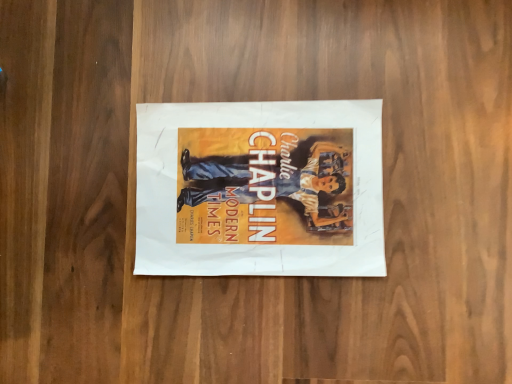
Describe the element at coordinates (260, 189) in the screenshot. I see `matte paper poster at center` at that location.

Where is `matte paper poster at center`? The width and height of the screenshot is (512, 384). matte paper poster at center is located at coordinates (260, 189).

Measure the distance between matte paper poster at center and camera.

The depth of matte paper poster at center is 19.59 inches.

Identify the location of matte paper poster at center. This screenshot has width=512, height=384. (260, 189).